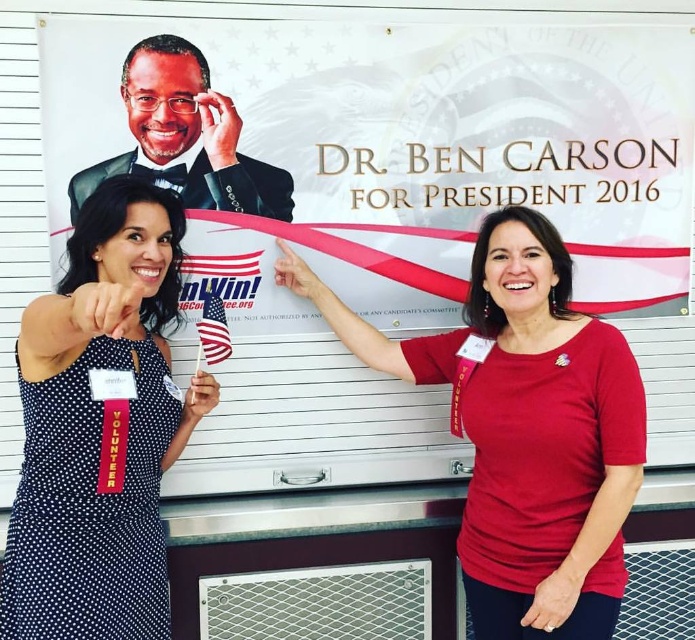
Question: Can you confirm if red matte shirt at center is positioned below matte black suit at upper left?

Choices:
 (A) no
 (B) yes

Answer: (B)

Question: Which object appears closest to the camera in this image?

Choices:
 (A) black dotted dress at left
 (B) american flag at center

Answer: (A)

Question: Which object is positioned closest to the black dotted dress at left?

Choices:
 (A) american flag at center
 (B) white paperboard at upper center

Answer: (A)

Question: Can you confirm if black dotted dress at left is bigger than matte black suit at upper left?

Choices:
 (A) no
 (B) yes

Answer: (B)

Question: Can you confirm if white paperboard at upper center is wider than matte black suit at upper left?

Choices:
 (A) yes
 (B) no

Answer: (A)

Question: Based on their relative distances, which object is nearer to the black dotted dress at left?

Choices:
 (A) red matte shirt at center
 (B) matte black suit at upper left

Answer: (B)